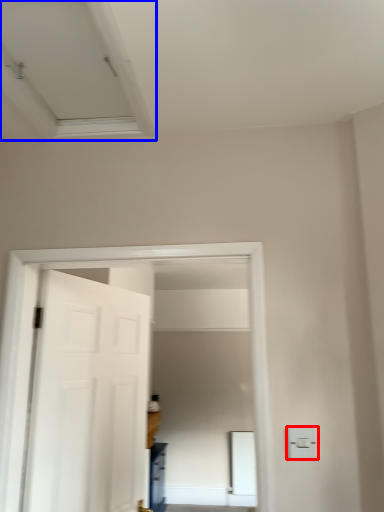
Question: Which object is further to the camera taking this photo, light switch (highlighted by a red box) or exhaust hood (highlighted by a blue box)?

Choices:
 (A) light switch
 (B) exhaust hood

Answer: (A)